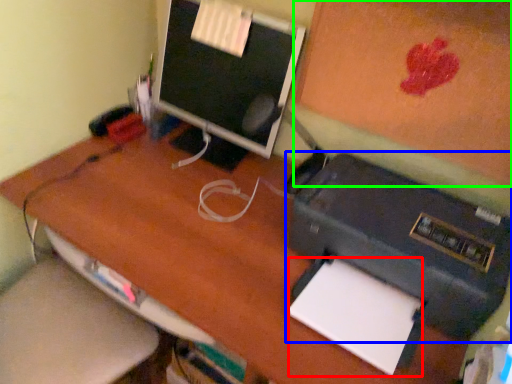
Question: Which is farther away from notepad (highlighted by a red box)? printer (highlighted by a blue box) or bulletin board (highlighted by a green box)?

Choices:
 (A) printer
 (B) bulletin board

Answer: (B)